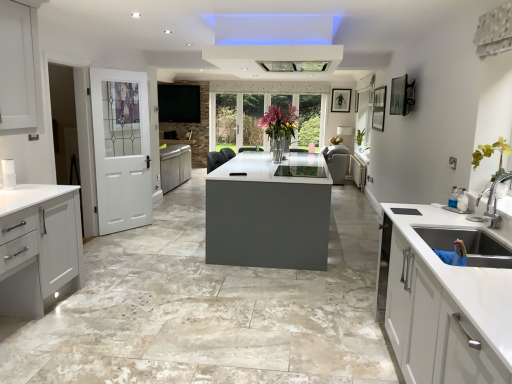
Question: From the image's perspective, is matte white cabinet at left, the second cabinetry from the right, over translucent glass vase at center?

Choices:
 (A) no
 (B) yes

Answer: (A)

Question: Considering the relative sizes of matte white cabinet at left, the second cabinetry from the right, and translucent glass vase at center in the image provided, is matte white cabinet at left, the second cabinetry from the right, thinner than translucent glass vase at center?

Choices:
 (A) yes
 (B) no

Answer: (B)

Question: Is matte white cabinet at left, placed as the 1th cabinetry when sorted from bottom to top, aimed at translucent glass vase at center?

Choices:
 (A) no
 (B) yes

Answer: (A)

Question: Is matte white cabinet at left, arranged as the first cabinetry when viewed from the front, to the right of translucent glass vase at center from the viewer's perspective?

Choices:
 (A) yes
 (B) no

Answer: (B)

Question: Is matte white cabinet at left, arranged as the first cabinetry when viewed from the front, surrounding translucent glass vase at center?

Choices:
 (A) yes
 (B) no

Answer: (B)

Question: Looking at their shapes, would you say matte white cabinet at left, placed as the 1th cabinetry when sorted from bottom to top, is wider or thinner than white glossy concrete at center?

Choices:
 (A) wide
 (B) thin

Answer: (B)

Question: Which is correct: matte white cabinet at left, which is the first cabinetry in left-to-right order, is inside white glossy concrete at center, or outside of it?

Choices:
 (A) inside
 (B) outside

Answer: (B)

Question: Based on their positions, is matte white cabinet at left, arranged as the first cabinetry when viewed from the front, located to the left or right of white glossy concrete at center?

Choices:
 (A) right
 (B) left

Answer: (B)

Question: Is point (0, 289) positioned closer to the camera than point (366, 228)?

Choices:
 (A) closer
 (B) farther

Answer: (A)

Question: From the image's perspective, is white matte cabinet at center, the 1th cabinetry viewed from the top, positioned above or below translucent glass vase at center?

Choices:
 (A) below
 (B) above

Answer: (A)

Question: Based on their sizes in the image, would you say white matte cabinet at center, which appears as the second cabinetry when viewed from the left, is bigger or smaller than translucent glass vase at center?

Choices:
 (A) big
 (B) small

Answer: (B)

Question: Is white matte cabinet at center, which appears as the second cabinetry when viewed from the left, in front of or behind translucent glass vase at center in the image?

Choices:
 (A) front
 (B) behind

Answer: (B)

Question: Would you say white matte cabinet at center, the 1th cabinetry in the right-to-left sequence, is to the left or to the right of translucent glass vase at center in the picture?

Choices:
 (A) right
 (B) left

Answer: (A)

Question: In the image, is translucent glass vase at center on the left side or the right side of white glossy concrete at center?

Choices:
 (A) left
 (B) right

Answer: (B)

Question: From a real-world perspective, is translucent glass vase at center above or below white glossy concrete at center?

Choices:
 (A) above
 (B) below

Answer: (A)